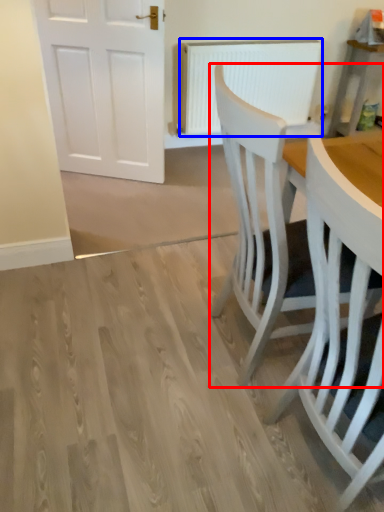
Question: Which object appears closest to the camera in this image, chair (highlighted by a red box) or radiator (highlighted by a blue box)?

Choices:
 (A) chair
 (B) radiator

Answer: (A)